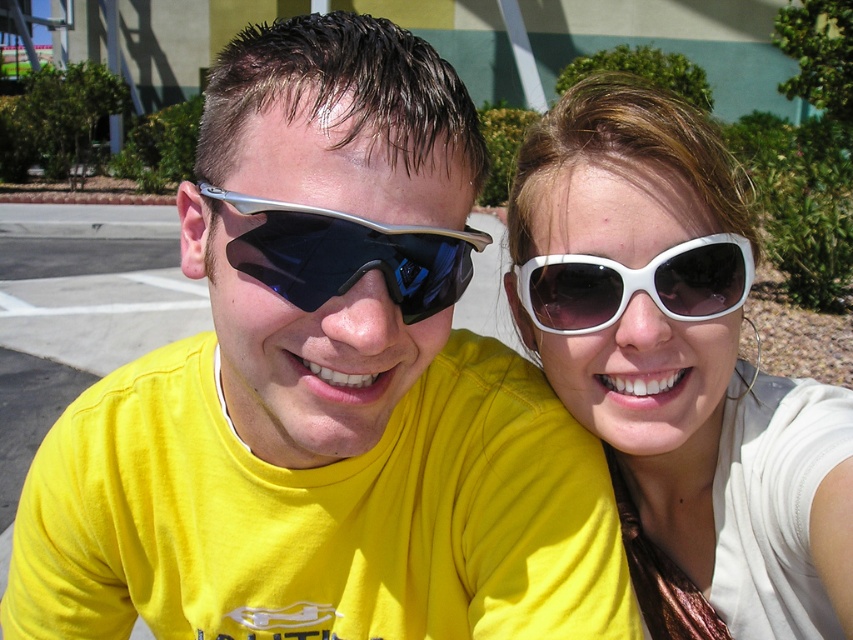
You are a photographer trying to capture a closeup shot of the white matte sunglasses at upper right. Given that your camera can focus on objects within 30 inches, will you need to move closer or farther away to get a clear focus?

The white matte sunglasses at upper right is 34.15 inches away from the viewer. Since the camera can focus within 30 inches, you need to move closer to achieve a clear focus.